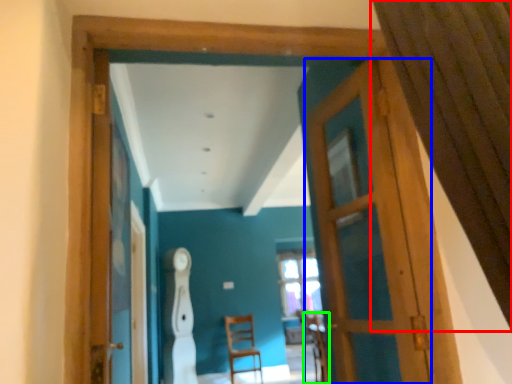
Question: Which object is the closest to the curtain (highlighted by a red box)? Choose among these: door (highlighted by a blue box) or armchair (highlighted by a green box).

Choices:
 (A) door
 (B) armchair

Answer: (A)